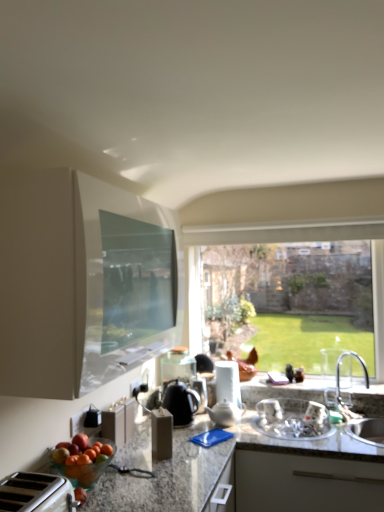
Question: From the image's perspective, does granite countertop at lower left appear higher than white glossy kettle at center, the 2th appliance when ordered from front to back?

Choices:
 (A) no
 (B) yes

Answer: (A)

Question: Can you confirm if granite countertop at lower left is taller than white glossy kettle at center, the 2th appliance when ordered from front to back?

Choices:
 (A) no
 (B) yes

Answer: (B)

Question: Is white glossy kettle at center, the 2th appliance when ordered from front to back, surrounded by granite countertop at lower left?

Choices:
 (A) no
 (B) yes

Answer: (B)

Question: Can you confirm if granite countertop at lower left is wider than white glossy kettle at center, which is the second appliance in back-to-front order?

Choices:
 (A) no
 (B) yes

Answer: (B)

Question: Is granite countertop at lower left far from white glossy kettle at center, positioned as the second appliance in right-to-left order?

Choices:
 (A) no
 (B) yes

Answer: (A)

Question: Considering the relative sizes of granite countertop at lower left and white glossy kettle at center, positioned as the second appliance in right-to-left order, in the image provided, is granite countertop at lower left shorter than white glossy kettle at center, positioned as the second appliance in right-to-left order,?

Choices:
 (A) no
 (B) yes

Answer: (A)

Question: Is white ceramic teapot at center, positioned as the second tea pot in left-to-right order, positioned with its back to white glossy cabinet at upper left, the first cabinetry in the top-to-bottom sequence?

Choices:
 (A) no
 (B) yes

Answer: (A)

Question: Can you confirm if white ceramic teapot at center, which is the first tea pot from right to left, is taller than white glossy cabinet at upper left, the first cabinetry in the top-to-bottom sequence?

Choices:
 (A) no
 (B) yes

Answer: (A)

Question: Is white ceramic teapot at center, positioned as the second tea pot in left-to-right order, oriented towards white glossy cabinet at upper left, which is the second cabinetry from bottom to top?

Choices:
 (A) yes
 (B) no

Answer: (B)

Question: Does white ceramic teapot at center, which is the first tea pot from right to left, appear on the right side of white glossy cabinet at upper left, which is the second cabinetry from bottom to top?

Choices:
 (A) yes
 (B) no

Answer: (A)

Question: Is white ceramic teapot at center, positioned as the second tea pot in left-to-right order, positioned beyond the bounds of white glossy cabinet at upper left, the first cabinetry in the top-to-bottom sequence?

Choices:
 (A) no
 (B) yes

Answer: (B)

Question: Are white ceramic teapot at center, positioned as the second tea pot in left-to-right order, and white glossy cabinet at upper left, the first cabinetry in the top-to-bottom sequence, beside each other?

Choices:
 (A) yes
 (B) no

Answer: (B)

Question: Does white glossy sink at lower center, the 1th sink in the left-to-right sequence, have a greater width compared to white glossy cabinet at upper left, the first cabinetry in the top-to-bottom sequence?

Choices:
 (A) yes
 (B) no

Answer: (A)